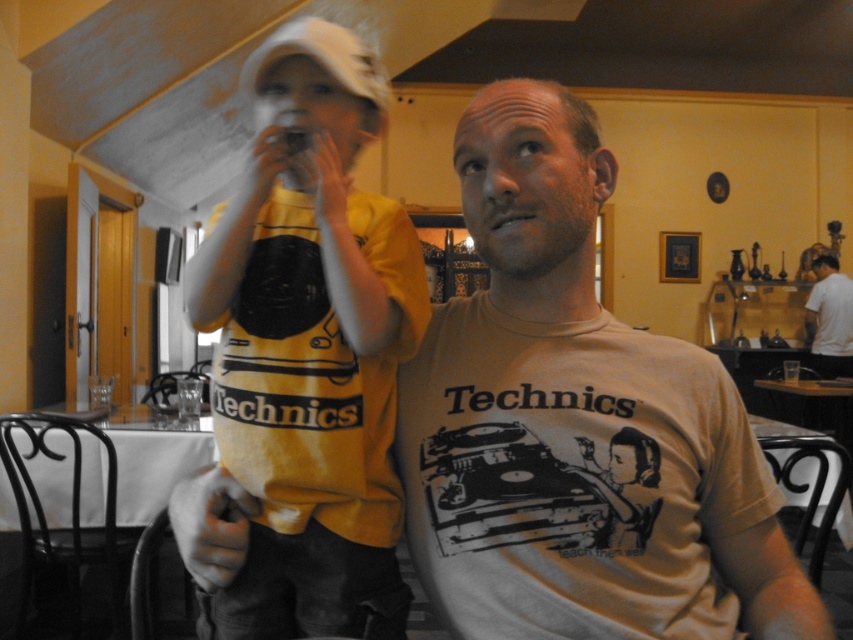
Question: Can you confirm if matte beige t-shirt at center is wider than white t-shirt at center?

Choices:
 (A) yes
 (B) no

Answer: (A)

Question: Which object is closer to the camera taking this photo?

Choices:
 (A) matte beige t-shirt at center
 (B) white t-shirt at center

Answer: (A)

Question: Is matte beige t-shirt at center in front of white t-shirt at center?

Choices:
 (A) yes
 (B) no

Answer: (A)

Question: Does matte beige t-shirt at center come in front of white t-shirt at center?

Choices:
 (A) no
 (B) yes

Answer: (B)